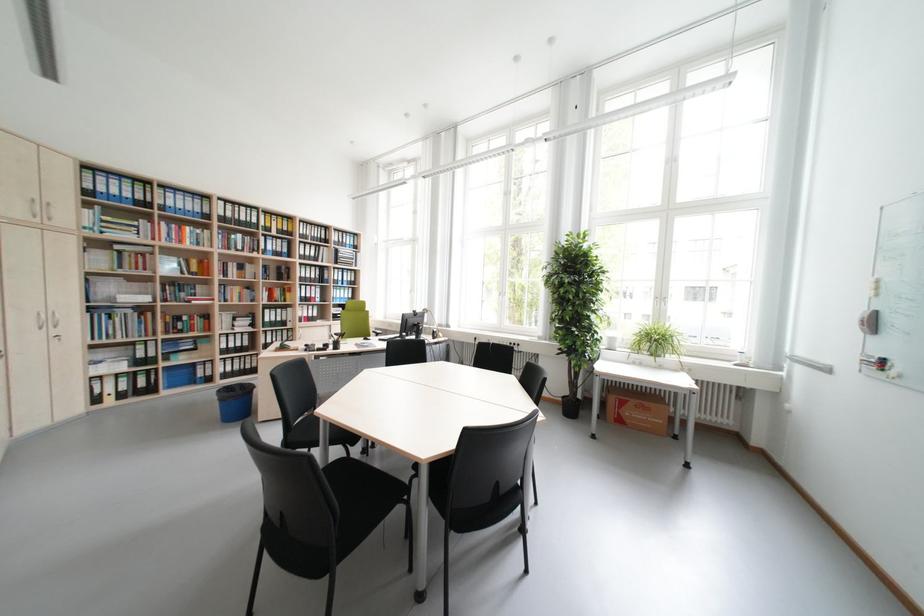
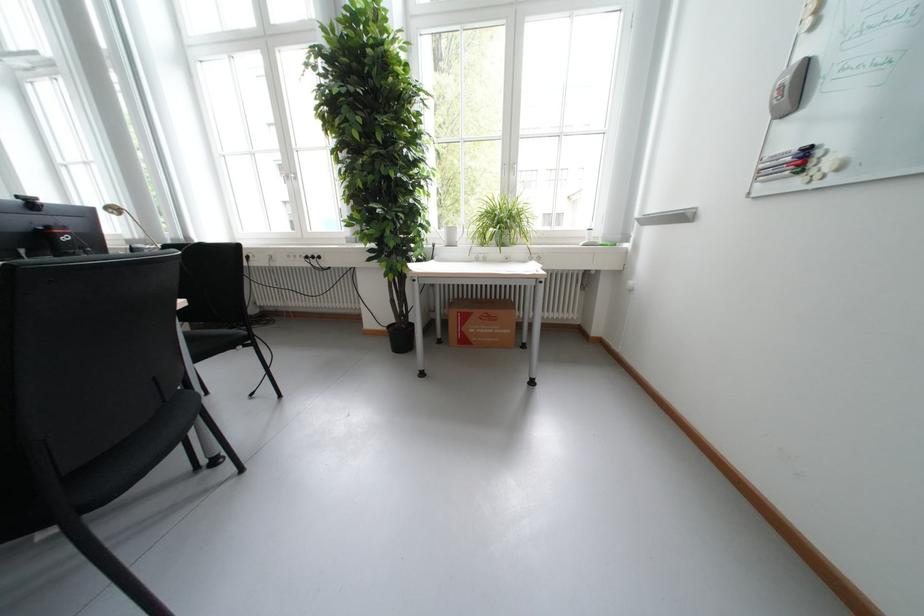
Locate, in the second image, the point that corresponds to [525,345] in the first image.

(322, 257)